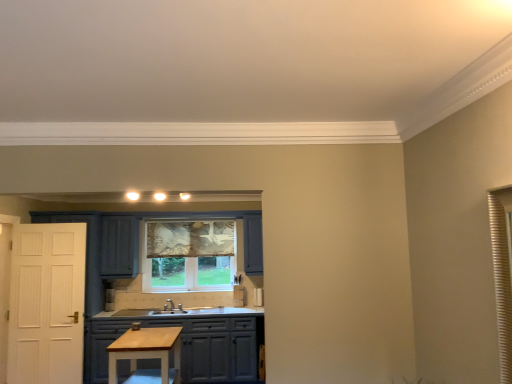
Question: Is patterned fabric window at center positioned in front of light wood table at center?

Choices:
 (A) yes
 (B) no

Answer: (B)

Question: Would you consider patterned fabric window at center to be distant from light wood table at center?

Choices:
 (A) yes
 (B) no

Answer: (A)

Question: Is patterned fabric window at center positioned with its back to light wood table at center?

Choices:
 (A) no
 (B) yes

Answer: (A)

Question: From a real-world perspective, is patterned fabric window at center located beneath light wood table at center?

Choices:
 (A) yes
 (B) no

Answer: (B)

Question: From the image's perspective, is patterned fabric window at center located above light wood table at center?

Choices:
 (A) yes
 (B) no

Answer: (A)

Question: Can you confirm if patterned fabric window at center is positioned to the left of light wood table at center?

Choices:
 (A) no
 (B) yes

Answer: (A)

Question: Can you confirm if patterned fabric window at center is wider than matte gray cabinets at center?

Choices:
 (A) no
 (B) yes

Answer: (A)

Question: From a real-world perspective, does patterned fabric window at center sit lower than matte gray cabinets at center?

Choices:
 (A) no
 (B) yes

Answer: (A)

Question: Does patterned fabric window at center appear on the left side of matte gray cabinets at center?

Choices:
 (A) yes
 (B) no

Answer: (B)

Question: Considering the relative sizes of patterned fabric window at center and matte gray cabinets at center in the image provided, is patterned fabric window at center taller than matte gray cabinets at center?

Choices:
 (A) no
 (B) yes

Answer: (B)

Question: Is patterned fabric window at center at the right side of matte gray cabinets at center?

Choices:
 (A) no
 (B) yes

Answer: (B)

Question: Is patterned fabric window at center next to matte gray cabinets at center?

Choices:
 (A) no
 (B) yes

Answer: (A)

Question: Is matte gray cabinets at center taller than light wood table at center?

Choices:
 (A) no
 (B) yes

Answer: (B)